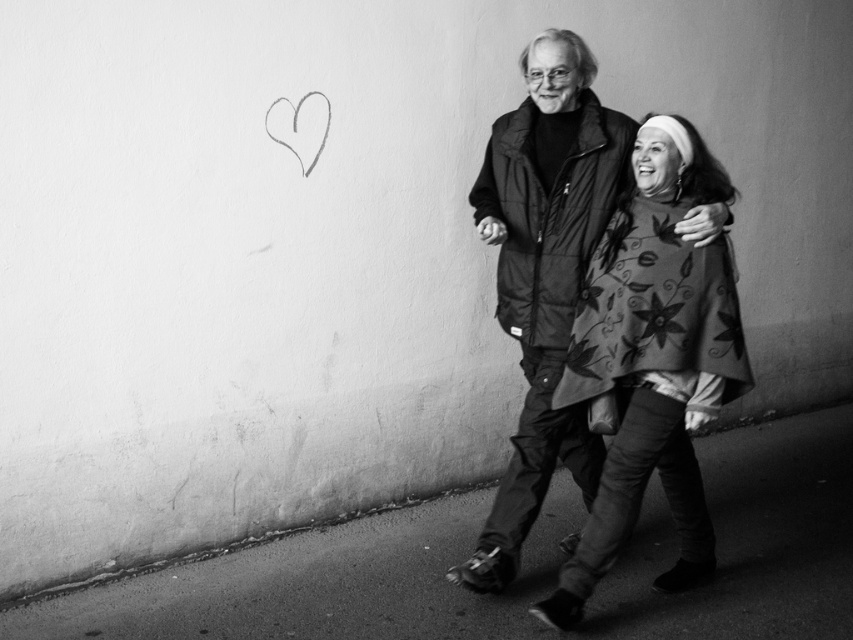
Between smooth asphalt at lower center and gray sketch heart at upper left, which one is positioned lower?

Positioned lower is smooth asphalt at lower center.

Who is positioned more to the right, smooth asphalt at lower center or gray sketch heart at upper left?

smooth asphalt at lower center is more to the right.

What do you see at coordinates (521, 564) in the screenshot?
I see `smooth asphalt at lower center` at bounding box center [521, 564].

Locate an element on the screen. smooth asphalt at lower center is located at coordinates (521, 564).

Between smooth asphalt at lower center and floral-patterned fabric cape at center-right, which one has less height?

With less height is smooth asphalt at lower center.

Between smooth asphalt at lower center and floral-patterned fabric cape at center-right, which one appears on the left side from the viewer's perspective?

smooth asphalt at lower center is more to the left.

Which is in front, point (405, 563) or point (675, 422)?

Positioned in front is point (675, 422).

Locate an element on the screen. smooth asphalt at lower center is located at coordinates (521, 564).

Describe the element at coordinates (521, 564) in the screenshot. The height and width of the screenshot is (640, 853). I see `smooth asphalt at lower center` at that location.

Does smooth asphalt at lower center lie behind matte black jacket at center?

No, it is in front of matte black jacket at center.

Is point (474, 611) positioned in front of point (578, 461)?

That is True.

Image resolution: width=853 pixels, height=640 pixels. What are the coordinates of `smooth asphalt at lower center` in the screenshot? It's located at (521, 564).